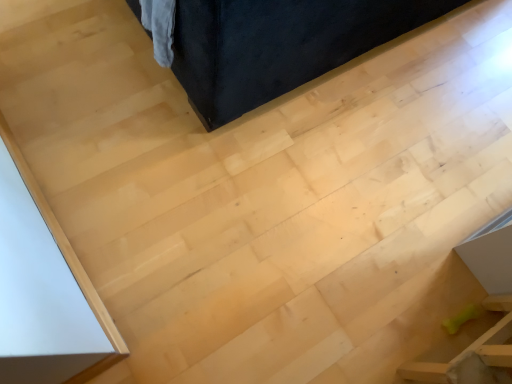
Where is `velvet dark blue couch at upper center, the first furniture from the top`? The image size is (512, 384). velvet dark blue couch at upper center, the first furniture from the top is located at coordinates (278, 45).

What do you see at coordinates (278, 45) in the screenshot?
I see `velvet dark blue couch at upper center, placed as the 2th furniture when sorted from bottom to top` at bounding box center [278, 45].

You are a GUI agent. You are given a task and a screenshot of the screen. Output one action in this format:
    pyautogui.click(x=<x>, y=<y>)
    Task: Click on the green rubber bone at lower right, arranged as the first furniture when ordered from the bottom
    
    Given the screenshot: What is the action you would take?
    pyautogui.click(x=473, y=354)

What do you see at coordinates (473, 354) in the screenshot? The height and width of the screenshot is (384, 512). I see `green rubber bone at lower right, arranged as the first furniture when ordered from the bottom` at bounding box center [473, 354].

This screenshot has width=512, height=384. I want to click on velvet dark blue couch at upper center, placed as the 2th furniture when sorted from bottom to top, so click(278, 45).

From the picture: Can you confirm if velvet dark blue couch at upper center, the first furniture from the top, is positioned to the left of green rubber bone at lower right, arranged as the first furniture when ordered from the bottom?

Indeed, velvet dark blue couch at upper center, the first furniture from the top, is positioned on the left side of green rubber bone at lower right, arranged as the first furniture when ordered from the bottom.

Does velvet dark blue couch at upper center, placed as the 2th furniture when sorted from bottom to top, come in front of green rubber bone at lower right, acting as the second furniture starting from the top?

That is False.

Is point (376, 32) closer to viewer compared to point (489, 334)?

That is False.

From the image's perspective, which is above, velvet dark blue couch at upper center, placed as the 2th furniture when sorted from bottom to top, or green rubber bone at lower right, arranged as the first furniture when ordered from the bottom?

velvet dark blue couch at upper center, placed as the 2th furniture when sorted from bottom to top.

From a real-world perspective, is velvet dark blue couch at upper center, the first furniture from the top, below green rubber bone at lower right, arranged as the first furniture when ordered from the bottom?

Incorrect, from a real-world perspective, velvet dark blue couch at upper center, the first furniture from the top, is higher than green rubber bone at lower right, arranged as the first furniture when ordered from the bottom.

Can you confirm if velvet dark blue couch at upper center, placed as the 2th furniture when sorted from bottom to top, is thinner than green rubber bone at lower right, arranged as the first furniture when ordered from the bottom?

No.

Is velvet dark blue couch at upper center, the first furniture from the top, shorter than green rubber bone at lower right, acting as the second furniture starting from the top?

No, velvet dark blue couch at upper center, the first furniture from the top, is not shorter than green rubber bone at lower right, acting as the second furniture starting from the top.

Considering the relative sizes of velvet dark blue couch at upper center, the first furniture from the top, and green rubber bone at lower right, acting as the second furniture starting from the top, in the image provided, is velvet dark blue couch at upper center, the first furniture from the top, smaller than green rubber bone at lower right, acting as the second furniture starting from the top,?

No.

Choose the correct answer: Is velvet dark blue couch at upper center, the first furniture from the top, inside green rubber bone at lower right, arranged as the first furniture when ordered from the bottom, or outside it?

velvet dark blue couch at upper center, the first furniture from the top, is not enclosed by green rubber bone at lower right, arranged as the first furniture when ordered from the bottom.

Is velvet dark blue couch at upper center, placed as the 2th furniture when sorted from bottom to top, next to green rubber bone at lower right, arranged as the first furniture when ordered from the bottom, and touching it?

No.

Based on the photo, does velvet dark blue couch at upper center, placed as the 2th furniture when sorted from bottom to top, turn towards green rubber bone at lower right, arranged as the first furniture when ordered from the bottom?

No.

How many degrees apart are the facing directions of velvet dark blue couch at upper center, the first furniture from the top, and green rubber bone at lower right, acting as the second furniture starting from the top?

89.8 degrees separate the facing orientations of velvet dark blue couch at upper center, the first furniture from the top, and green rubber bone at lower right, acting as the second furniture starting from the top.

Locate an element on the screen. This screenshot has width=512, height=384. furniture that is under the velvet dark blue couch at upper center, the first furniture from the top (from a real-world perspective) is located at coordinates (473, 354).

Considering the relative positions of green rubber bone at lower right, acting as the second furniture starting from the top, and velvet dark blue couch at upper center, the first furniture from the top, in the image provided, is green rubber bone at lower right, acting as the second furniture starting from the top, to the right of velvet dark blue couch at upper center, the first furniture from the top, from the viewer's perspective?

Yes, green rubber bone at lower right, acting as the second furniture starting from the top, is to the right of velvet dark blue couch at upper center, the first furniture from the top.

Which object is further away from the camera taking this photo, green rubber bone at lower right, acting as the second furniture starting from the top, or velvet dark blue couch at upper center, placed as the 2th furniture when sorted from bottom to top?

velvet dark blue couch at upper center, placed as the 2th furniture when sorted from bottom to top, is more distant.

Looking at this image, which point is more forward, (x=454, y=368) or (x=304, y=15)?

Positioned in front is point (x=454, y=368).

Based on the photo, from the image's perspective, which is below, green rubber bone at lower right, arranged as the first furniture when ordered from the bottom, or velvet dark blue couch at upper center, the first furniture from the top?

green rubber bone at lower right, arranged as the first furniture when ordered from the bottom, appears lower in the image.

From a real-world perspective, which object stands above the other?

In real-world perspective, velvet dark blue couch at upper center, the first furniture from the top, is above.

Between green rubber bone at lower right, arranged as the first furniture when ordered from the bottom, and velvet dark blue couch at upper center, placed as the 2th furniture when sorted from bottom to top, which one has larger width?

Wider between the two is velvet dark blue couch at upper center, placed as the 2th furniture when sorted from bottom to top.

Can you confirm if green rubber bone at lower right, acting as the second furniture starting from the top, is taller than velvet dark blue couch at upper center, the first furniture from the top?

In fact, green rubber bone at lower right, acting as the second furniture starting from the top, may be shorter than velvet dark blue couch at upper center, the first furniture from the top.

Does green rubber bone at lower right, arranged as the first furniture when ordered from the bottom, have a larger size compared to velvet dark blue couch at upper center, placed as the 2th furniture when sorted from bottom to top?

No.

Would you say green rubber bone at lower right, arranged as the first furniture when ordered from the bottom, is inside or outside velvet dark blue couch at upper center, the first furniture from the top?

green rubber bone at lower right, arranged as the first furniture when ordered from the bottom, is outside velvet dark blue couch at upper center, the first furniture from the top.

In the scene shown: Is green rubber bone at lower right, acting as the second furniture starting from the top, not near velvet dark blue couch at upper center, the first furniture from the top?

No, green rubber bone at lower right, acting as the second furniture starting from the top, is not far away from velvet dark blue couch at upper center, the first furniture from the top.

Is green rubber bone at lower right, acting as the second furniture starting from the top, turned away from velvet dark blue couch at upper center, the first furniture from the top?

No, velvet dark blue couch at upper center, the first furniture from the top, is not at the back of green rubber bone at lower right, acting as the second furniture starting from the top.

Measure the distance from green rubber bone at lower right, acting as the second furniture starting from the top, to velvet dark blue couch at upper center, the first furniture from the top.

They are 92.83 centimeters apart.

Where is `furniture that is below the velvet dark blue couch at upper center, the first furniture from the top (from the image's perspective)`? The height and width of the screenshot is (384, 512). furniture that is below the velvet dark blue couch at upper center, the first furniture from the top (from the image's perspective) is located at coordinates (473, 354).

Identify the location of furniture that appears on the left of green rubber bone at lower right, acting as the second furniture starting from the top. (278, 45).

Identify the location of furniture lying in front of the velvet dark blue couch at upper center, the first furniture from the top. The width and height of the screenshot is (512, 384). (473, 354).